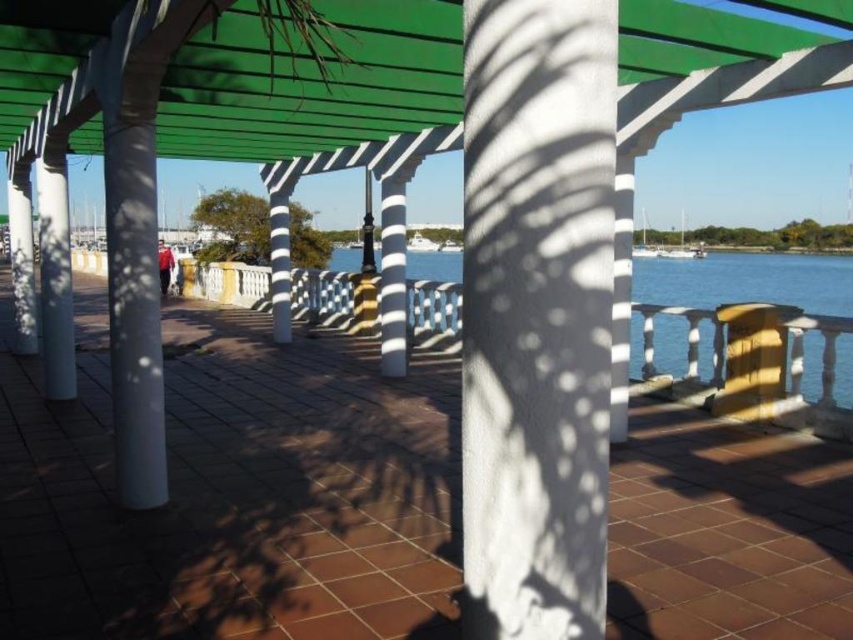
You are a painter standing on the walkway, wanting to set up your easel between the white textured pillar at center and the green plastic canopy at upper center. Your easel requires a minimum of 4 meters of space between the two objects to fit comfortably. Can you set up your easel there?

The white textured pillar at center and green plastic canopy at upper center are 3.92 meters apart from each other, which is less than the required 4 meters. Therefore, you cannot set up your easel there comfortably.

You are standing on the walkway and want to place a 5.5 feet long wooden bench between the white textured pillar at center and another similar pillar. Will the bench fit exactly between them?

The distance between the white textured pillar at center and the other pillar is 5.56 feet, so a 5.5 feet long wooden bench will fit with a small amount of space remaining.

You are standing on the covered walkway and want to move from the point at coordinates point [492,394] to the point at coordinates point [164,29]. Which direction should you move to get closer to your destination?

You should move backward because point [492,394] is in front of point [164,29], meaning your destination is behind your current position.